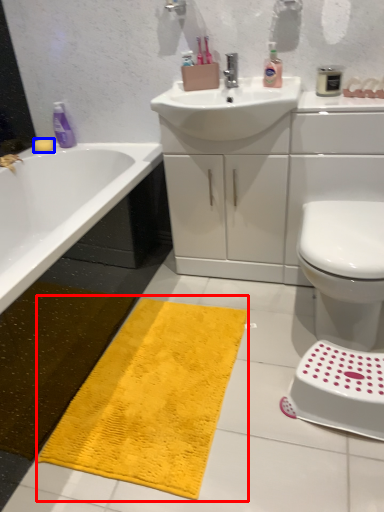
Question: Which of the following is the farthest to the observer, bath mat (highlighted by a red box) or soap (highlighted by a blue box)?

Choices:
 (A) bath mat
 (B) soap

Answer: (B)